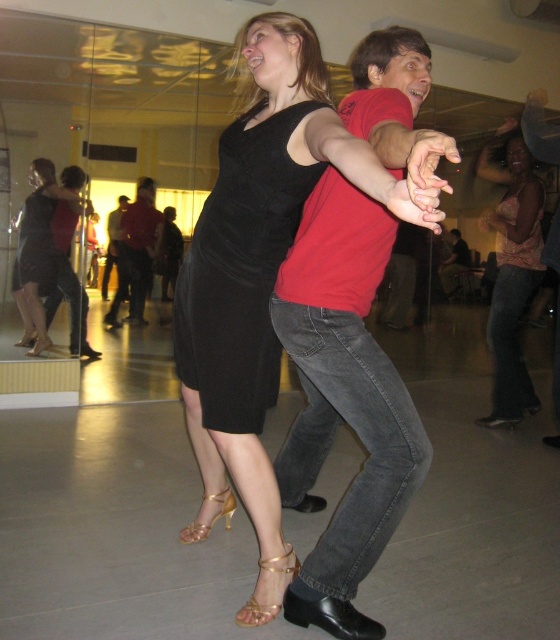
You are standing in the dance studio and see a point marked at coordinates (512, 275). According to the scene description, which object does this point belong to?

The point at coordinates (512, 275) is located on the pink satin blouse at lower right.

You are a photographer positioned at point (36, 252) in the dance studio. You want to capture a photo of the matte black dress at center. Is there any object in your direct line of sight that might obstruct your shot?

The point (36, 252) is where the matte black dress at center is located, so there is no obstruction in your direct line of sight.

In the scene shown: You are a photographer positioned at the front of the dance studio. You want to take a photo that includes both the point at (x=528, y=285) and the point at (x=114, y=316). Which point will appear larger in the photo?

Point at (x=528, y=285) will appear larger because it is closer to the camera than point at (x=114, y=316).